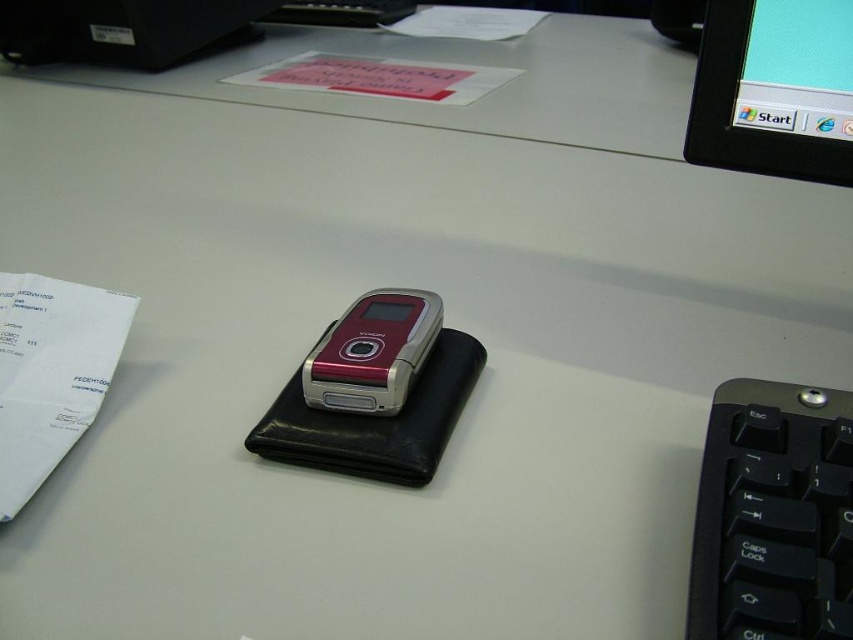
You are setting up a new monitor on your desk and want to place it next to the metallic red phone at center. Based on the image, will the black glossy monitor at upper right fit vertically without overlapping the phone?

The black glossy monitor at upper right is taller than the metallic red phone at center, so it might not fit vertically without overlapping if placed next to it.

You are organizing your desk and need to place a new item between the black plastic keyboard at lower right and the white paper at left. Based on their sizes, which object should be placed closer to the edge of the desk to ensure the new item fits snugly between them?

The black plastic keyboard at lower right is shorter than the white paper at left. To fit the new item snugly between them, place the black plastic keyboard at lower right closer to the edge since it takes up less space.

You are organizing the desk and want to place a new item between the black glossy monitor at upper right and the metallic red phone at center. Is there enough vertical space between them to fit a 10cm tall object?

The black glossy monitor at upper right is located above the metallic red phone at center, but the exact vertical distance isn not provided. Without knowing the space between them, it is impossible to determine if a 10cm tall object can fit.